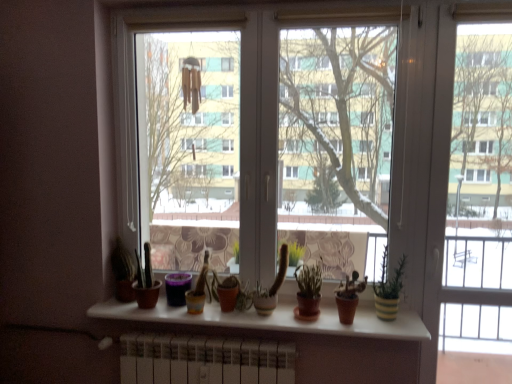
Question: Is yellow striped pot at right next to matte brown pot at center and touching it?

Choices:
 (A) no
 (B) yes

Answer: (A)

Question: Considering the relative positions of yellow striped pot at right and matte brown pot at center in the image provided, is yellow striped pot at right to the left of matte brown pot at center from the viewer's perspective?

Choices:
 (A) yes
 (B) no

Answer: (B)

Question: Is yellow striped pot at right to the right of matte brown pot at center from the viewer's perspective?

Choices:
 (A) yes
 (B) no

Answer: (A)

Question: From a real-world perspective, is yellow striped pot at right positioned under matte brown pot at center based on gravity?

Choices:
 (A) no
 (B) yes

Answer: (A)

Question: Can you confirm if yellow striped pot at right is wider than matte brown pot at center?

Choices:
 (A) no
 (B) yes

Answer: (A)

Question: Can you confirm if yellow striped pot at right is shorter than matte brown pot at center?

Choices:
 (A) yes
 (B) no

Answer: (B)

Question: Is green matte plant at center wider than yellow striped pot at right?

Choices:
 (A) yes
 (B) no

Answer: (A)

Question: Can you confirm if green matte plant at center is bigger than yellow striped pot at right?

Choices:
 (A) yes
 (B) no

Answer: (B)

Question: Is green matte plant at center oriented towards yellow striped pot at right?

Choices:
 (A) yes
 (B) no

Answer: (B)

Question: From a real-world perspective, is green matte plant at center below yellow striped pot at right?

Choices:
 (A) no
 (B) yes

Answer: (B)

Question: From the image's perspective, would you say green matte plant at center is shown under yellow striped pot at right?

Choices:
 (A) no
 (B) yes

Answer: (B)

Question: Is green matte plant at center oriented away from yellow striped pot at right?

Choices:
 (A) yes
 (B) no

Answer: (B)

Question: Considering the relative positions of yellow striped pot at right and white matte window sill at center in the image provided, is yellow striped pot at right behind white matte window sill at center?

Choices:
 (A) no
 (B) yes

Answer: (B)